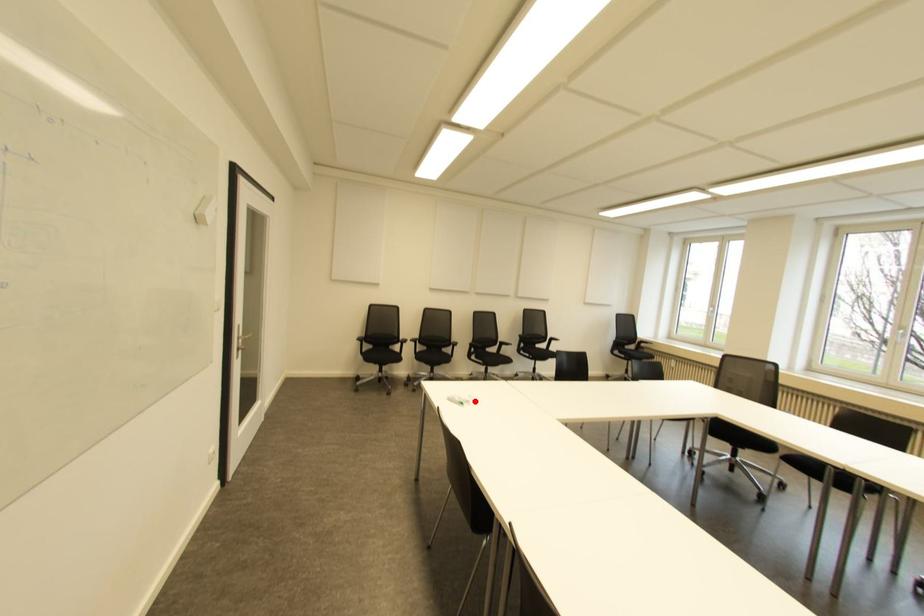
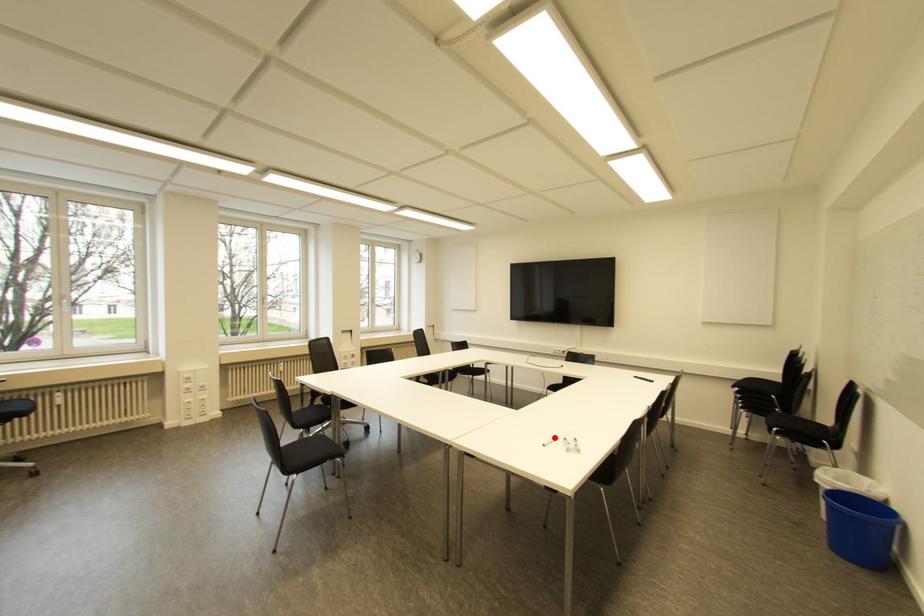
I am providing you with two images of the same scene from different viewpoints. A red point is marked on the first image and another point is marked on the second image. Do the highlighted points in image1 and image2 indicate the same real-world spot?

Yes